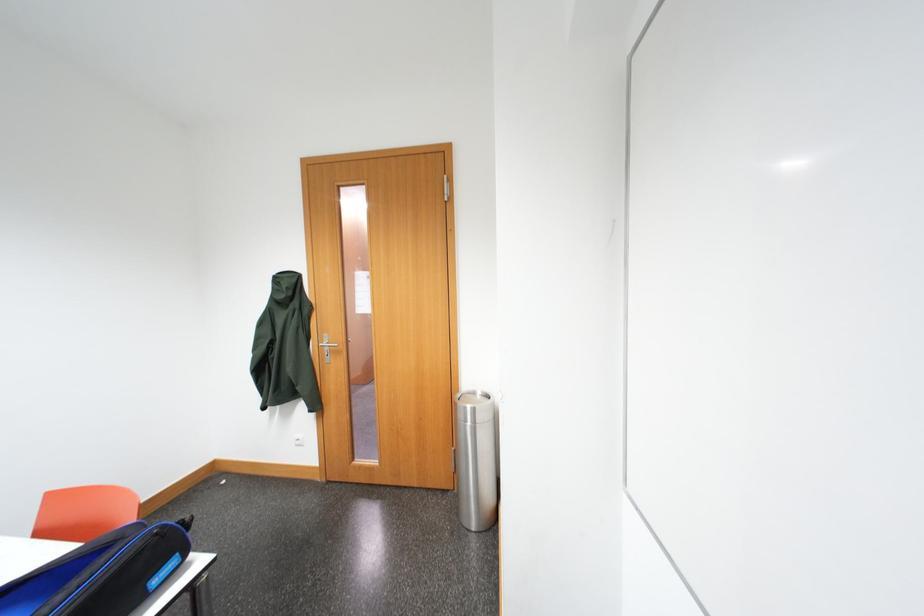
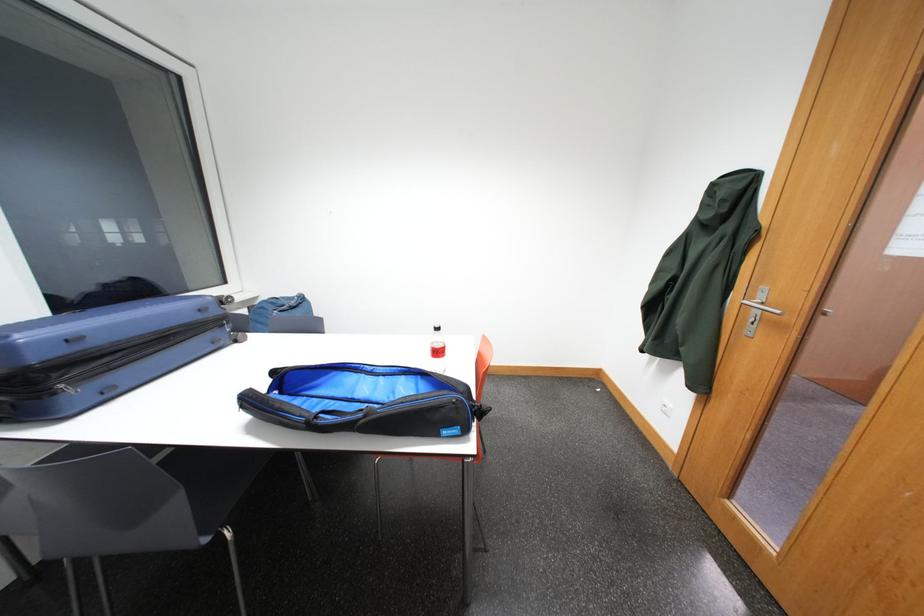
How did the camera likely rotate?

The camera rotated toward left-down.